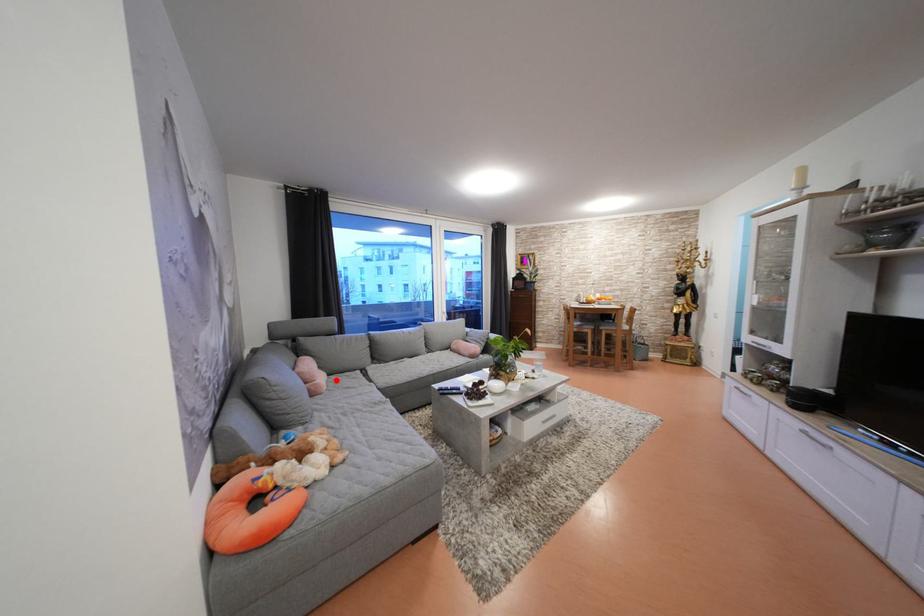
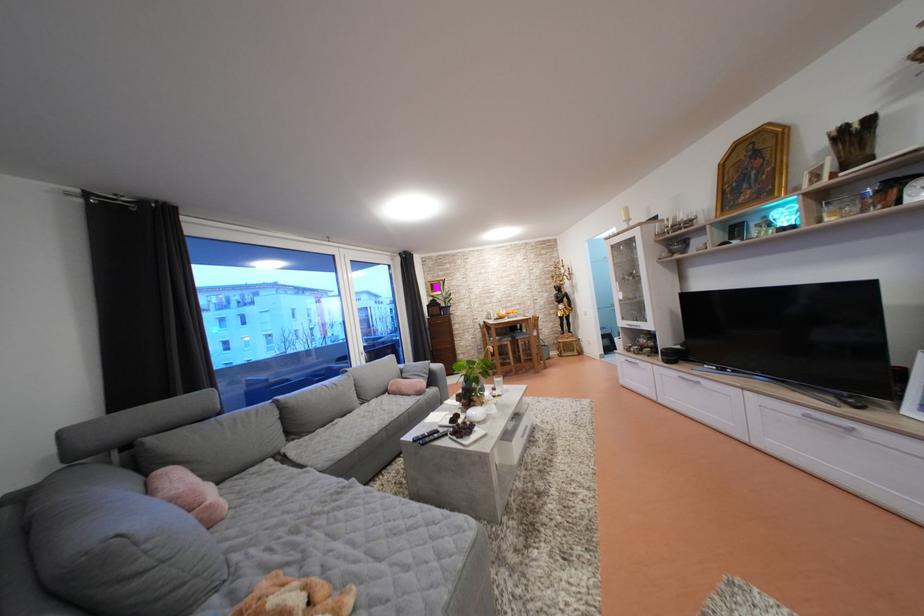
Find the pixel in the second image that matches the highlighted location in the first image.

(225, 488)